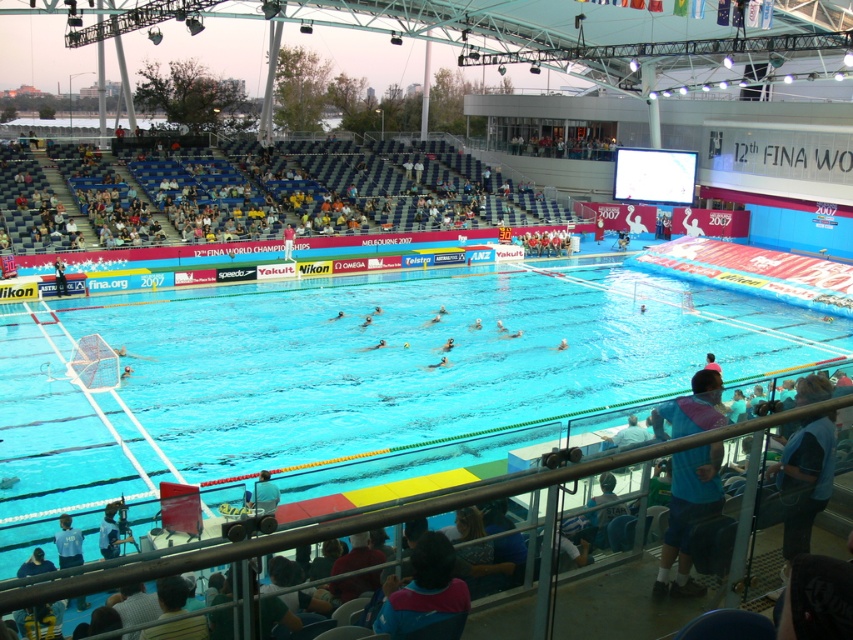
Question: Which object is positioned farthest from the blue fabric shirt at lower right?

Choices:
 (A) blue fabric shirt at lower left
 (B) blue fabric at lower center

Answer: (A)

Question: Does blue fabric shirt at lower right lie in front of blue fabric at lower center?

Choices:
 (A) yes
 (B) no

Answer: (A)

Question: Which of the following is the farthest from the observer?

Choices:
 (A) (115, 552)
 (B) (664, 536)

Answer: (A)

Question: Does blue fabric shirt at lower left appear on the left side of blue fabric at lower center?

Choices:
 (A) no
 (B) yes

Answer: (B)

Question: Observing the image, what is the correct spatial positioning of blue fabric shirt at lower left in reference to blue fabric at lower center?

Choices:
 (A) below
 (B) above

Answer: (A)

Question: Which of the following is the farthest from the observer?

Choices:
 (A) (270, 504)
 (B) (100, 541)
 (C) (685, 451)

Answer: (B)